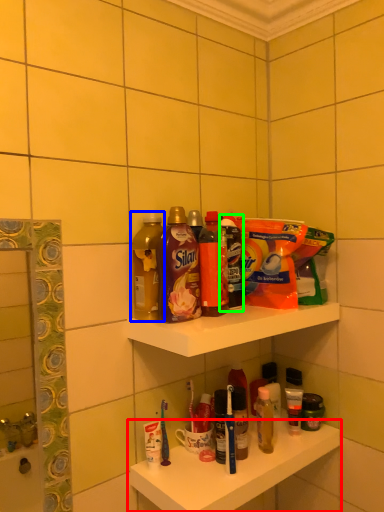
Question: Considering the real-world distances, which object is closest to shelf (highlighted by a red box)? bottle (highlighted by a blue box) or cleaning product (highlighted by a green box).

Choices:
 (A) bottle
 (B) cleaning product

Answer: (B)